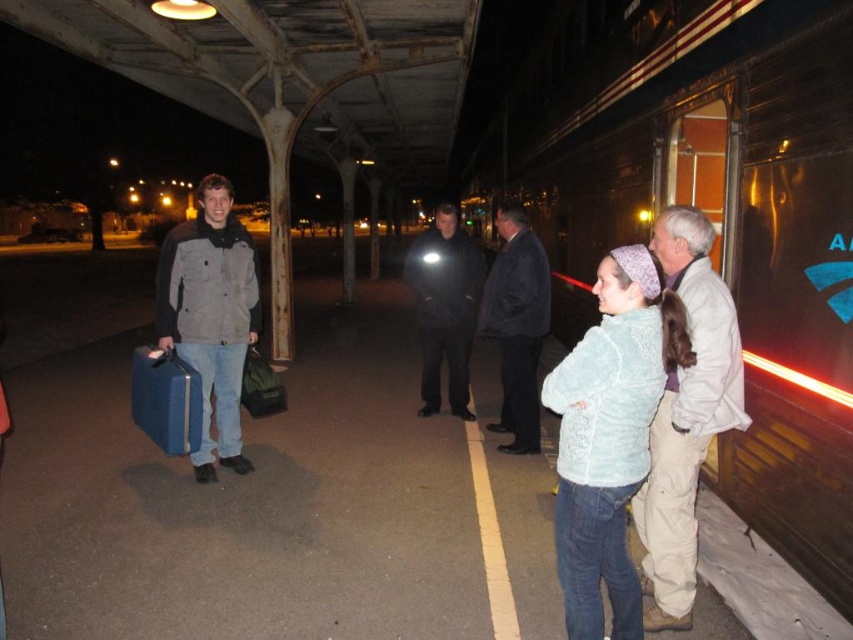
Does metallic silver train at right lie behind dark blue jacket at center?

No.

Between metallic silver train at right and dark blue jacket at center, which one has less height?

dark blue jacket at center

What do you see at coordinates (711, 216) in the screenshot? The image size is (853, 640). I see `metallic silver train at right` at bounding box center [711, 216].

Find the location of `metallic silver train at right`. metallic silver train at right is located at coordinates (711, 216).

Does light blue fuzzy sweater at right appear on the right side of light blue sweater at right?

Incorrect, light blue fuzzy sweater at right is not on the right side of light blue sweater at right.

Who is more distant from viewer, (639, 433) or (712, 330)?

The point (712, 330) is more distant.

Find the location of a particular element. The image size is (853, 640). light blue fuzzy sweater at right is located at coordinates (610, 435).

Does metallic silver train at right appear over light blue sweater at right?

Indeed, metallic silver train at right is positioned over light blue sweater at right.

Can you confirm if metallic silver train at right is taller than light blue sweater at right?

Correct, metallic silver train at right is much taller as light blue sweater at right.

Which is behind, point (567, 109) or point (688, 282)?

The point (567, 109) is behind.

In order to click on metallic silver train at right in this screenshot , I will do `click(711, 216)`.